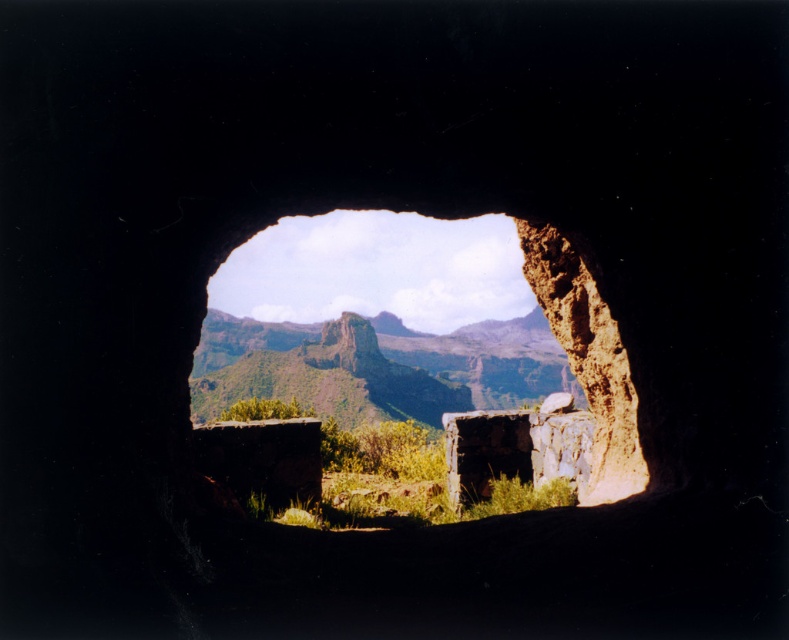
Does brown rocky cave at center have a lesser width compared to green grassy mountain at center?

Indeed, brown rocky cave at center has a lesser width compared to green grassy mountain at center.

Which is behind, point (477, 396) or point (294, 349)?

Positioned behind is point (477, 396).

Which is behind, point (556, 308) or point (257, 360)?

The point (257, 360) is behind.

At what (x,y) coordinates should I click in order to perform the action: click on brown rocky cave at center. Please return your answer as a coordinate pair (x, y). Looking at the image, I should click on (455, 368).